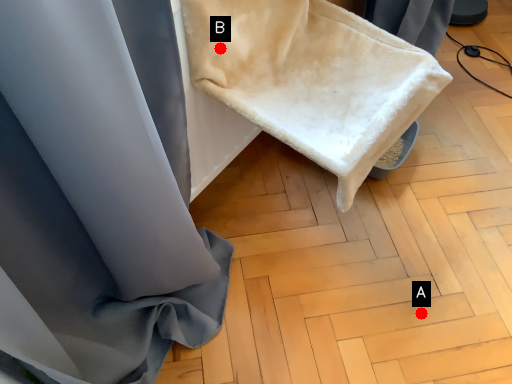
Question: Two points are circled on the image, labeled by A and B beside each circle. Which point is farther from the camera taking this photo?

Choices:
 (A) A is further
 (B) B is further

Answer: (A)